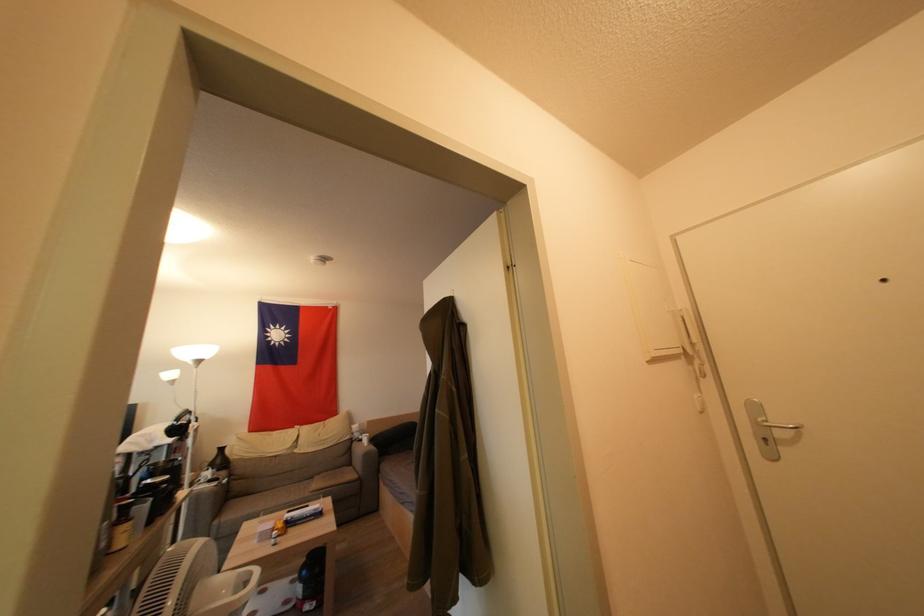
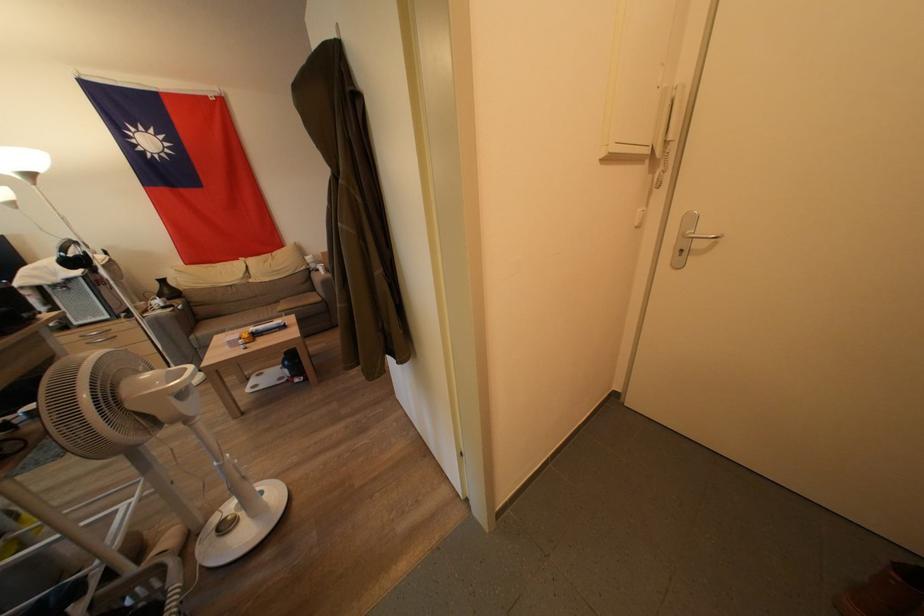
The point at (782, 422) is marked in the first image. Where is the corresponding point in the second image?

(710, 233)